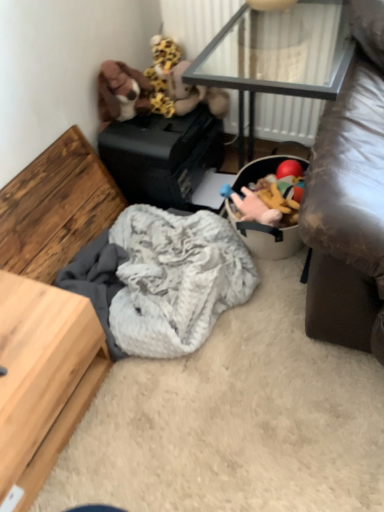
Question: Based on their positions, is transparent glass table at upper center located to the left or right of soft plush toy at center, the 4th toy from the left?

Choices:
 (A) left
 (B) right

Answer: (B)

Question: Is point (235, 71) closer or farther from the camera than point (231, 198)?

Choices:
 (A) farther
 (B) closer

Answer: (A)

Question: Which of these objects is positioned farthest from the fuzzy gray blanket at center?

Choices:
 (A) fuzzy fabric stuffed animal at upper center, arranged as the third toy when viewed from the right
 (B) transparent glass table at upper center
 (C) brown plush toy at upper left, arranged as the 1th toy when viewed from the left
 (D) soft plush toys at center
 (E) soft plush toy at center, the 4th toy from the left

Answer: (B)

Question: Which of these objects is positioned farthest from the soft plush toys at center?

Choices:
 (A) transparent glass table at upper center
 (B) brown plush toy at upper left, the fifth toy from the right
 (C) fluffy yellow and brown stuffed animal at upper center, the second toy when ordered from left to right
 (D) fuzzy gray blanket at center
 (E) fuzzy fabric stuffed animal at upper center, arranged as the third toy when viewed from the right

Answer: (B)